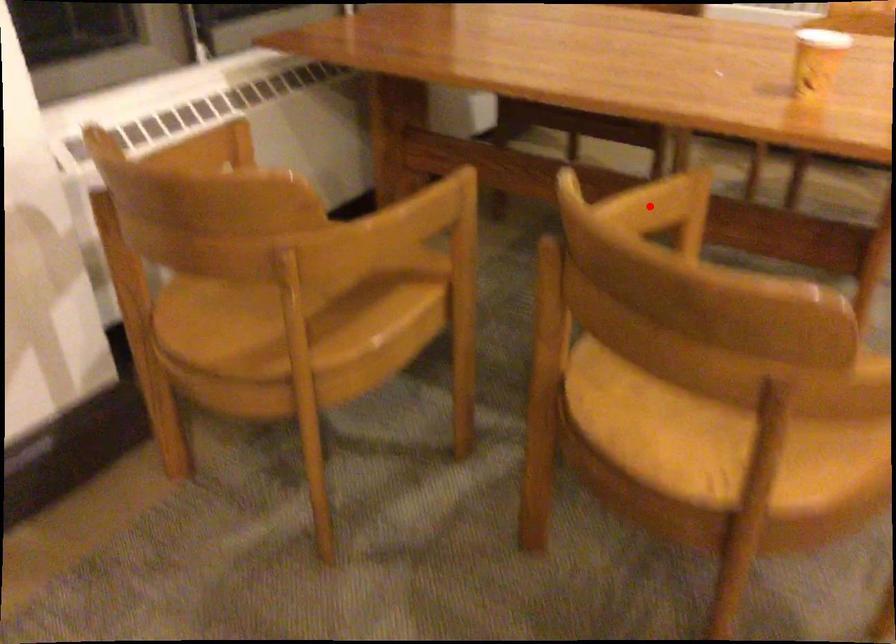
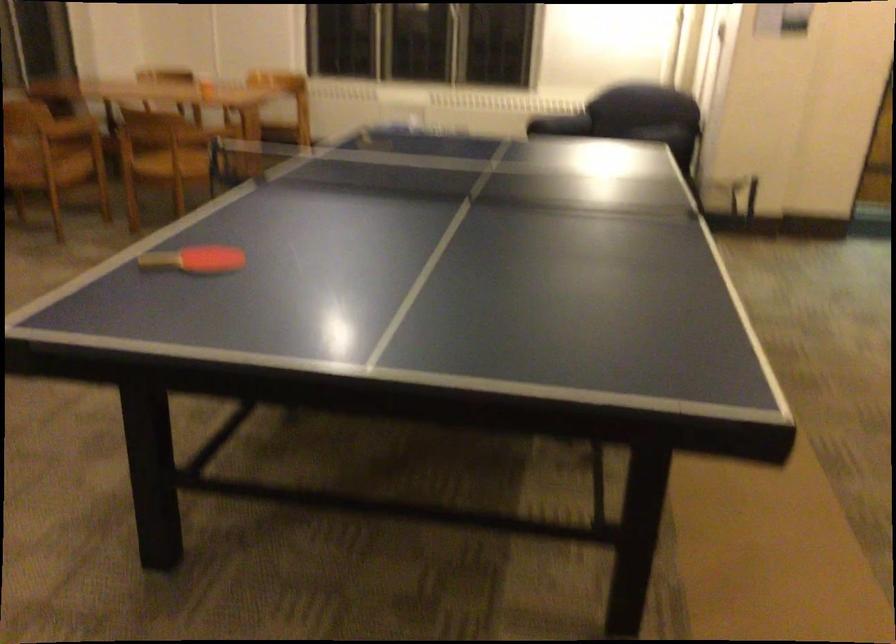
Question: I am providing you with two images of the same scene from different viewpoints. A red point is marked on the first image. At the location where the point appears in image 1, is it still visible in image 2?

Choices:
 (A) Yes
 (B) No

Answer: (B)